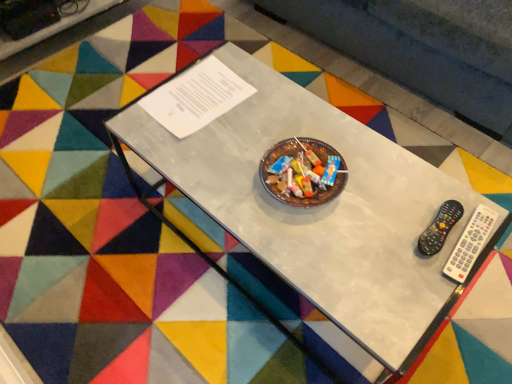
Locate an element on the screen. This screenshot has height=384, width=512. vacant space behind white plastic remote at right is located at coordinates (425, 187).